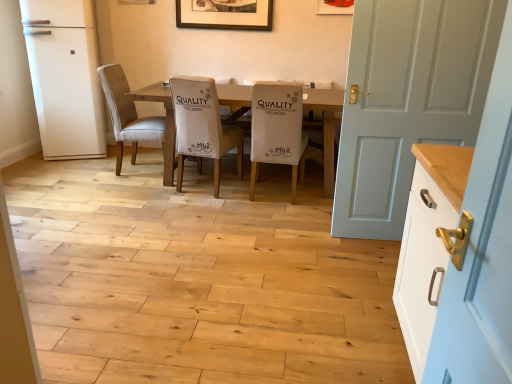
The image size is (512, 384). I want to click on vacant space that's between beige fabric chair at center, arranged as the third chair when viewed from the left, and white painted wood cabinet at right, so click(319, 254).